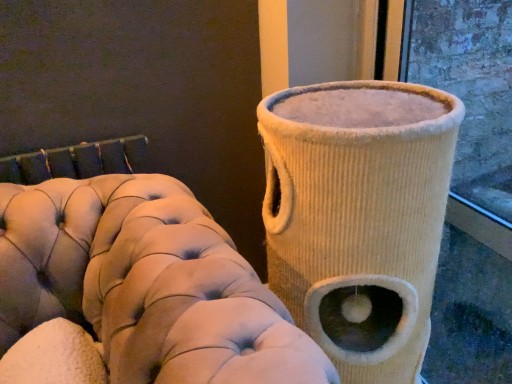
Question: Choose the correct answer: Is beige corduroy cat tree at right inside beige corduroy cat tree at right or outside it?

Choices:
 (A) outside
 (B) inside

Answer: (A)

Question: From a real-world perspective, is beige corduroy cat tree at right above or below beige corduroy cat tree at right?

Choices:
 (A) below
 (B) above

Answer: (B)

Question: Considering the positions of beige corduroy cat tree at right and beige corduroy cat tree at right in the image, is beige corduroy cat tree at right bigger or smaller than beige corduroy cat tree at right?

Choices:
 (A) big
 (B) small

Answer: (A)

Question: From a real-world perspective, is beige corduroy cat tree at right above or below beige corduroy cat tree at right?

Choices:
 (A) below
 (B) above

Answer: (A)

Question: Do you think beige corduroy cat tree at right is within beige corduroy cat tree at right, or outside of it?

Choices:
 (A) inside
 (B) outside

Answer: (B)

Question: In terms of height, does beige corduroy cat tree at right look taller or shorter compared to beige corduroy cat tree at right?

Choices:
 (A) tall
 (B) short

Answer: (A)

Question: Considering the positions of beige corduroy cat tree at right and beige corduroy cat tree at right in the image, is beige corduroy cat tree at right wider or thinner than beige corduroy cat tree at right?

Choices:
 (A) wide
 (B) thin

Answer: (B)